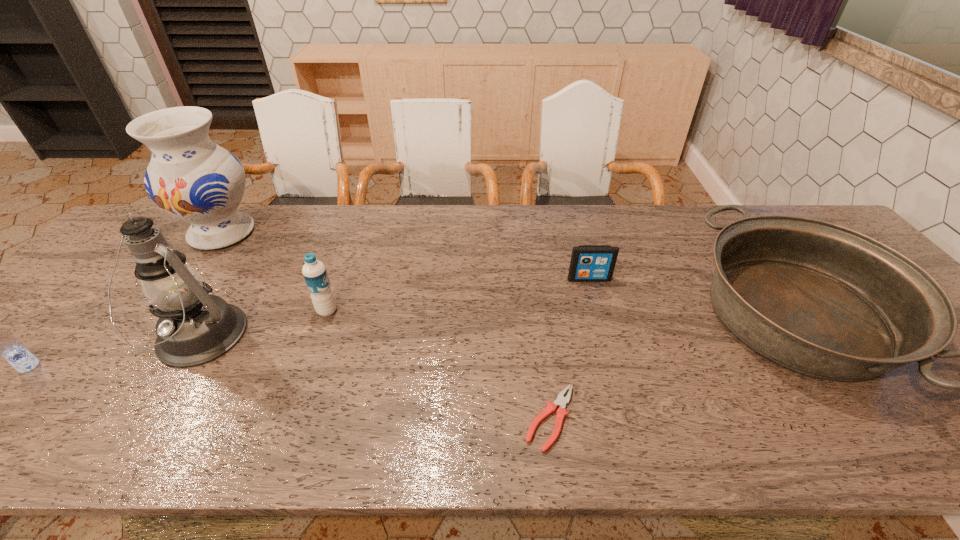
The height and width of the screenshot is (540, 960). Identify the location of vacant area located 0.330m on the label of the water bottle. (467, 311).

At what (x,y) coordinates should I click in order to perform the action: click on free space located on the right of the leftmost object. Please return your answer as a coordinate pair (x, y). The width and height of the screenshot is (960, 540). Looking at the image, I should click on (140, 366).

Where is `free point located on the front screen of the iPod`? free point located on the front screen of the iPod is located at coordinates (599, 317).

Identify the location of blank space located on the right of the shortest object. (602, 418).

This screenshot has height=540, width=960. What are the coordinates of `object present at the far edge` in the screenshot? It's located at (190, 177).

Locate an element on the screen. This screenshot has height=540, width=960. object present at the near edge is located at coordinates click(x=561, y=401).

At what (x,y) coordinates should I click in order to perform the action: click on object positioned at the left edge. Please return your answer as a coordinate pair (x, y). Image resolution: width=960 pixels, height=540 pixels. Looking at the image, I should click on (0, 341).

Image resolution: width=960 pixels, height=540 pixels. In order to click on vacant space at the far edge of the desktop in this screenshot , I will do `click(278, 214)`.

Where is `blank space at the near edge of the desktop`? blank space at the near edge of the desktop is located at coordinates (885, 431).

The height and width of the screenshot is (540, 960). In order to click on free region at the left edge of the desktop in this screenshot , I will do `click(34, 353)`.